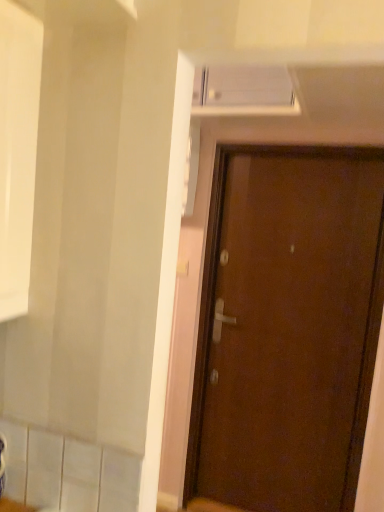
Image resolution: width=384 pixels, height=512 pixels. Identify the location of free point above brown matte door at center (from a real-world perspective). (305, 153).